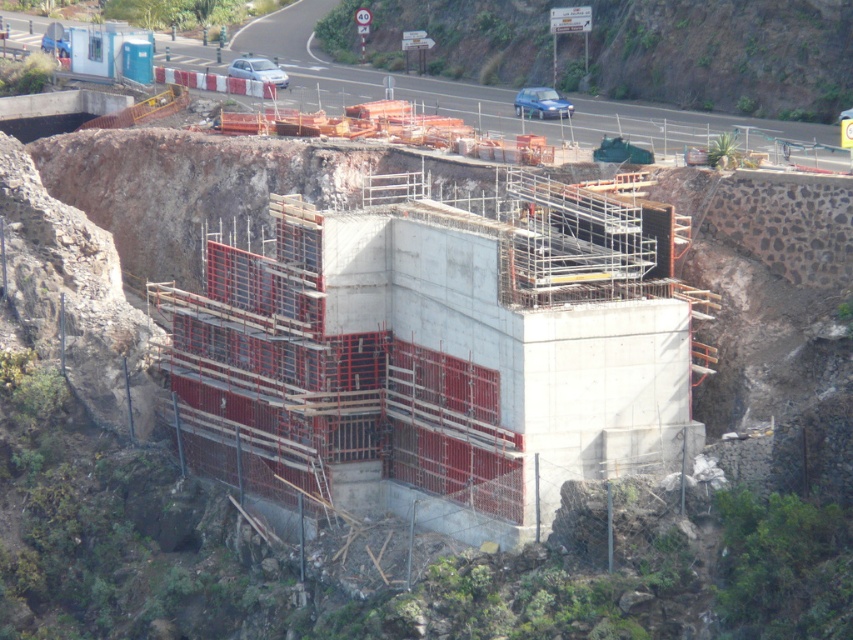
You are a construction worker standing at the edge of the excavation pit. You need to place a new section of scaffolding next to the concrete at center. Based on the coordinates provided, can you determine if the scaffolding will fit within the construction site boundaries?

The concrete at center is located at point (727, 56), so the scaffolding can be placed next to it as long as it stays within the site boundaries marked by the temporary fence around the excavation pit.

You are a construction worker standing at the base of the excavation pit. You need to place a heavy equipment on the concrete at center. However, you notice the green mossy rock at upper center nearby. Which object is higher in elevation and why?

The concrete at center is above the green mossy rock at upper center, meaning the concrete is higher in elevation. Therefore, placing the heavy equipment on the concrete at center is feasible as it is elevated compared to the rock.